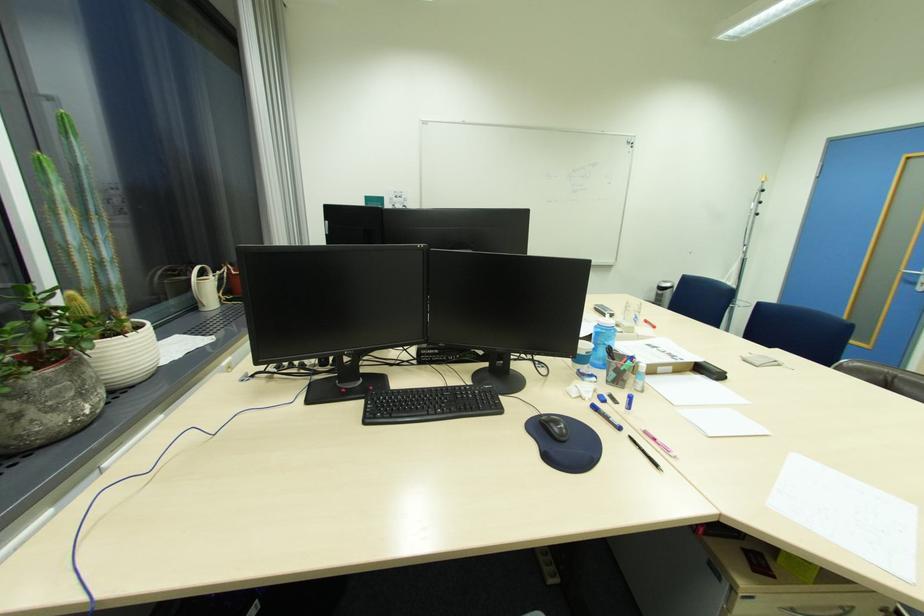
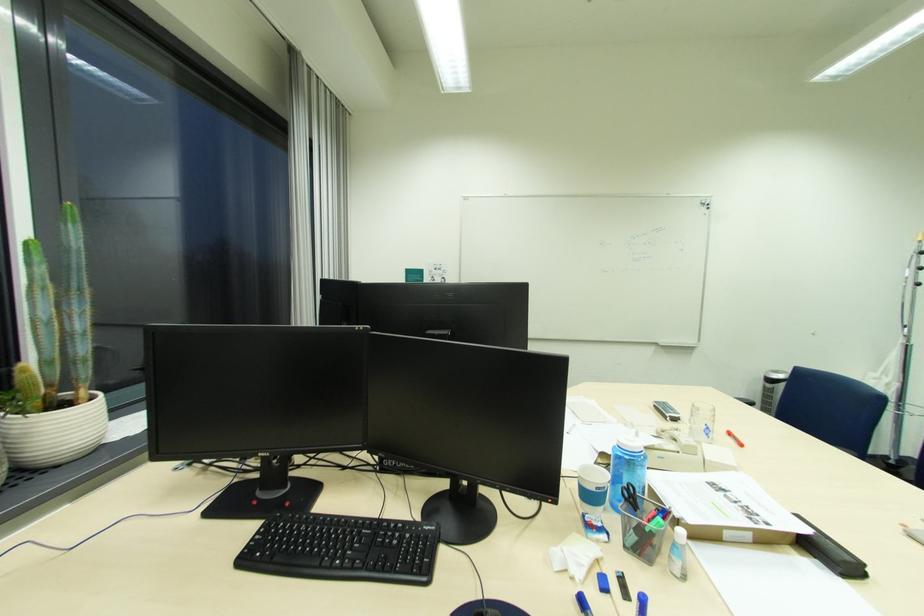
Find the pixel in the second image that matches (604,323) in the first image.

(624, 442)